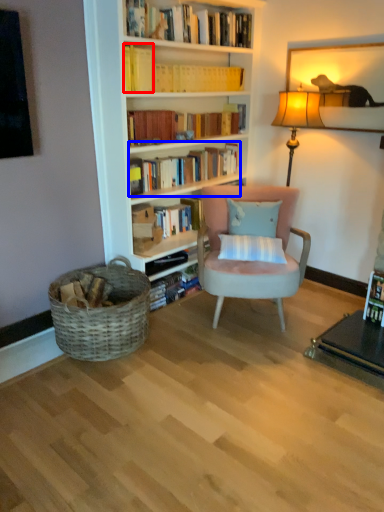
Question: Among these objects, which one is farthest to the camera, book (highlighted by a red box) or book (highlighted by a blue box)?

Choices:
 (A) book
 (B) book

Answer: (B)